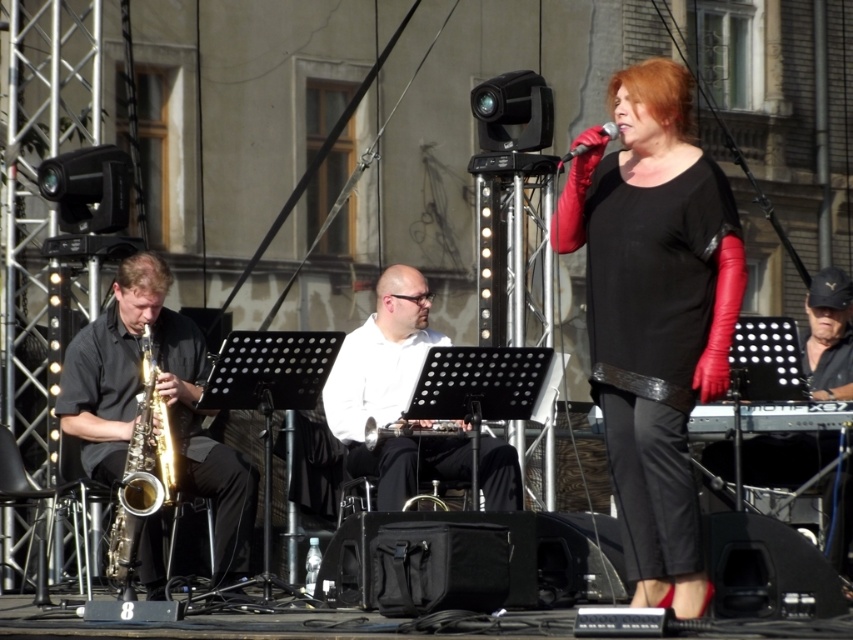
You are a photographer standing at the camera position. You want to capture a closeup shot of the shiny gold saxophone at left. Given that your camera has a maximum zoom range of 100 feet, will you be able to achieve this without moving closer?

The shiny gold saxophone at left and camera are 98.86 feet apart. Since the maximum zoom range is 100 feet, the photographer can achieve the closeup shot without moving closer.

You are a photographer standing behind the stage. You want to take a photo that includes both the shiny gold saxophone at left and the white smooth shirt at center. The camera you are using has a maximum focus range of 8 feet. Will you be able to capture both objects in focus without moving the camera?

The distance between the shiny gold saxophone at left and the white smooth shirt at center is 8.56 feet. Since the camera can only focus within 8 feet, the objects are slightly out of the focus range. Therefore, you won not be able to capture both in focus without moving the camera.

You are a photographer at the live performance. You want to capture a photo that includes both the black leather gloves at upper right and the shiny gold saxophone at left. Which object should you position closer to the right side of your camera frame?

The black leather gloves at upper right should be positioned closer to the right side of your camera frame since it is located to the right of the shiny gold saxophone at left.